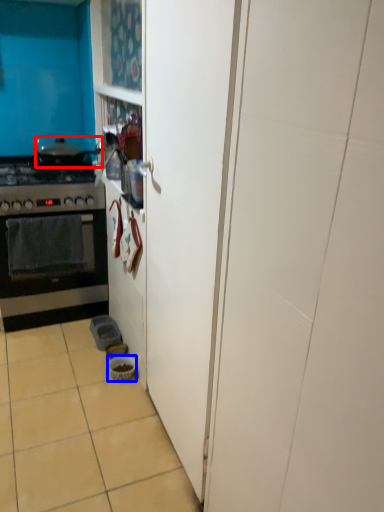
Question: Among these objects, which one is farthest to the camera, pot/pan (highlighted by a red box) or bowl (highlighted by a blue box)?

Choices:
 (A) pot/pan
 (B) bowl

Answer: (A)